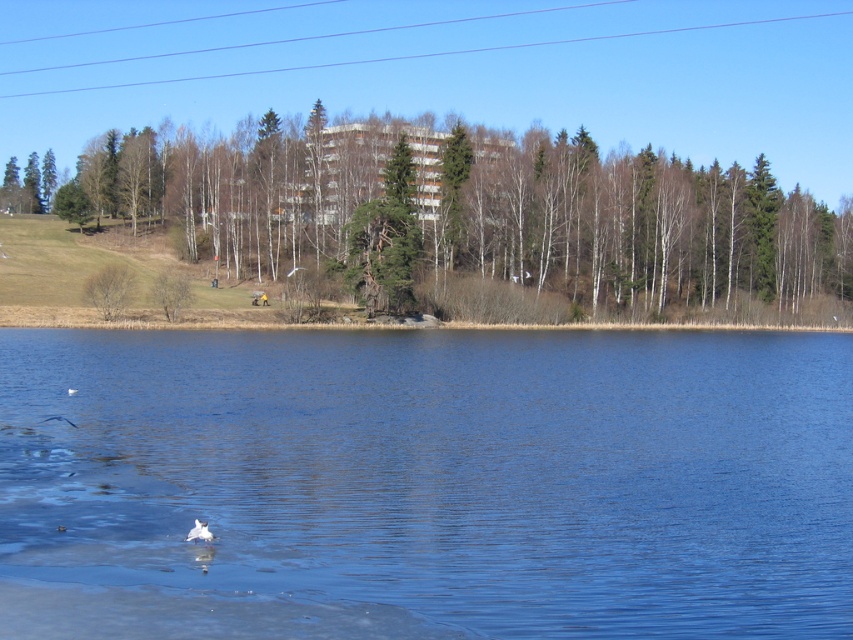
Is white feathered bird at lower center closer to camera compared to white feathered bird at lower left?

That is True.

Is white feathered bird at lower center smaller than white feathered bird at lower left?

Indeed, white feathered bird at lower center has a smaller size compared to white feathered bird at lower left.

Is point (193, 540) closer to camera compared to point (57, 416)?

That is True.

The width and height of the screenshot is (853, 640). Identify the location of white feathered bird at lower center. (199, 532).

Who is positioned more to the left, green leafy tree at center or white feathered bird at lower center?

green leafy tree at center

Consider the image. Is green leafy tree at center to the right of white feathered bird at lower center from the viewer's perspective?

In fact, green leafy tree at center is to the left of white feathered bird at lower center.

Is point (601, 180) farther from viewer compared to point (206, 522)?

Yes.

Find the location of a particular element. green leafy tree at center is located at coordinates (486, 211).

Which is more to the right, green leafy tree at center or green matte tree at lower left?

Positioned to the right is green leafy tree at center.

Which is in front, point (675, 186) or point (96, 289)?

Positioned in front is point (96, 289).

In order to click on green leafy tree at center in this screenshot , I will do `click(486, 211)`.